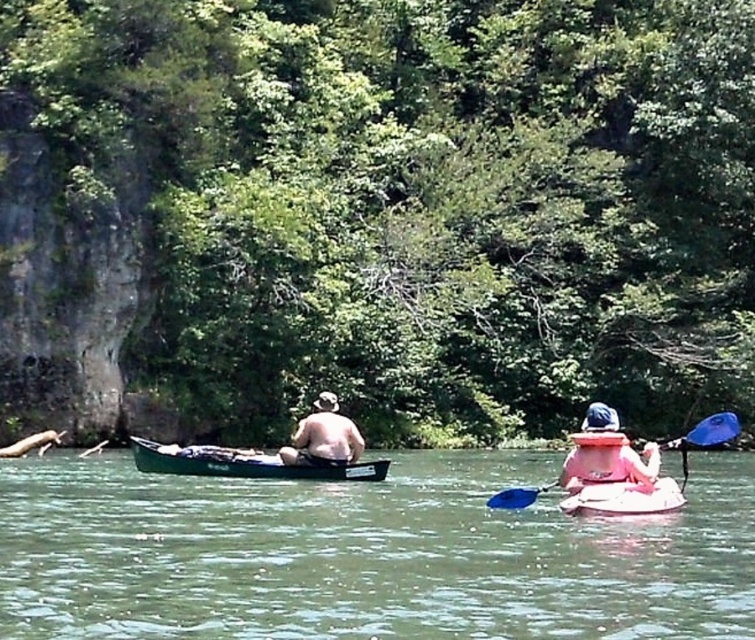
Question: Can you confirm if green rubber boat at center is thinner than pink life vest at right?

Choices:
 (A) no
 (B) yes

Answer: (A)

Question: Which object is the farthest from the pink life vest at right?

Choices:
 (A) blue plastic paddle at center
 (B) skinny white man at center
 (C) green plastic canoe at center

Answer: (C)

Question: Is green rubber boat at center further to camera compared to skinny white man at center?

Choices:
 (A) yes
 (B) no

Answer: (B)

Question: Which object appears farthest from the camera in this image?

Choices:
 (A) blue plastic paddle at center
 (B) green rubber boat at center
 (C) pink life vest at right
 (D) white foam boat at lower right

Answer: (A)

Question: Which object appears farthest from the camera in this image?

Choices:
 (A) skinny white man at center
 (B) green rubber boat at center

Answer: (A)

Question: Can you confirm if green plastic canoe at center is positioned above blue plastic paddle at center?

Choices:
 (A) yes
 (B) no

Answer: (B)